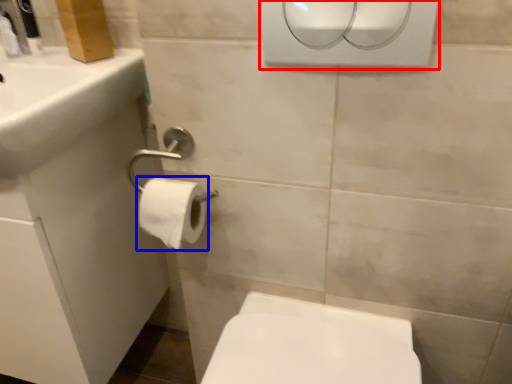
Question: Which point is further to the camera, hand dryer (highlighted by a red box) or toilet paper (highlighted by a blue box)?

Choices:
 (A) hand dryer
 (B) toilet paper

Answer: (B)